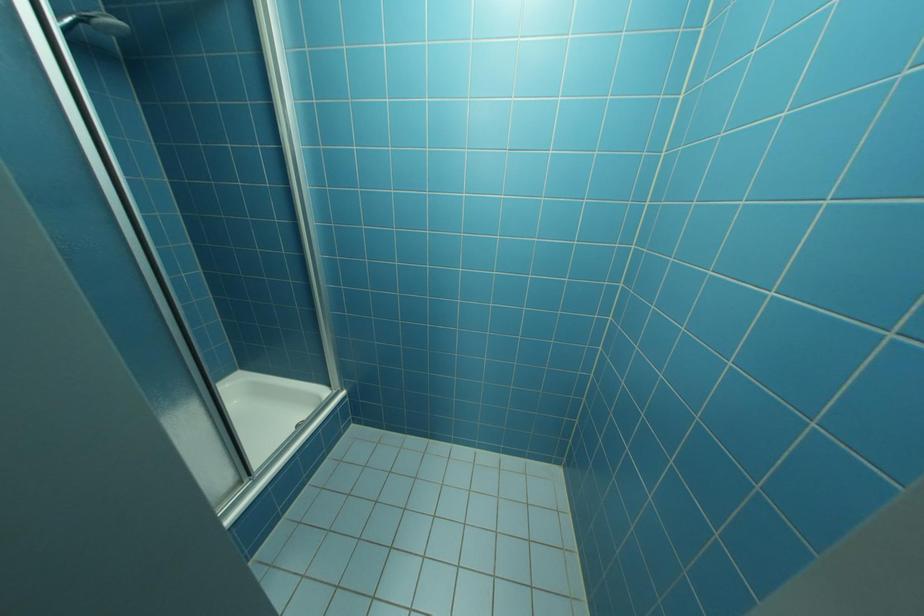
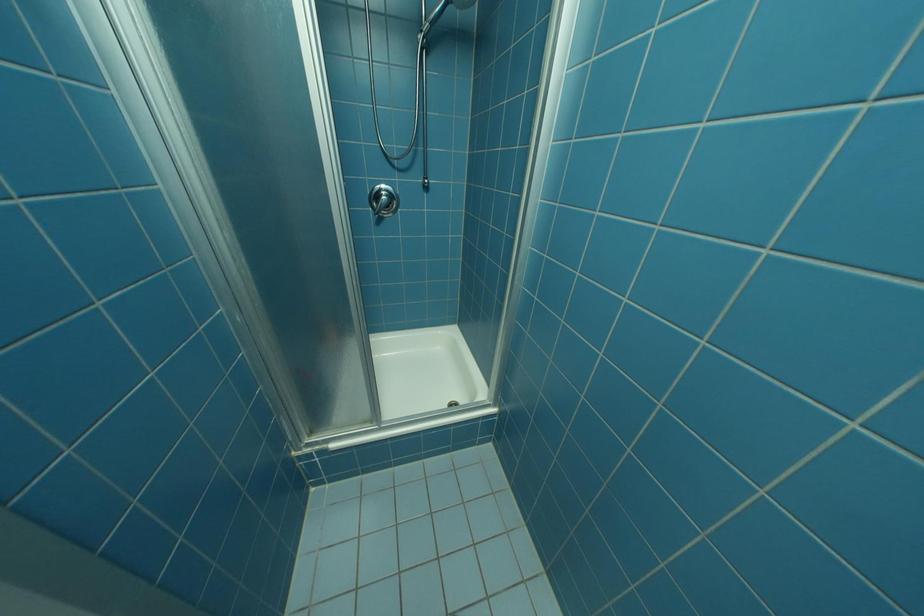
Question: The camera is either moving clockwise (left) or counter-clockwise (right) around the object. The first image is from the beginning of the video and the second image is from the end. Is the camera moving left or right when shooting the video?

Choices:
 (A) Left
 (B) Right

Answer: (B)